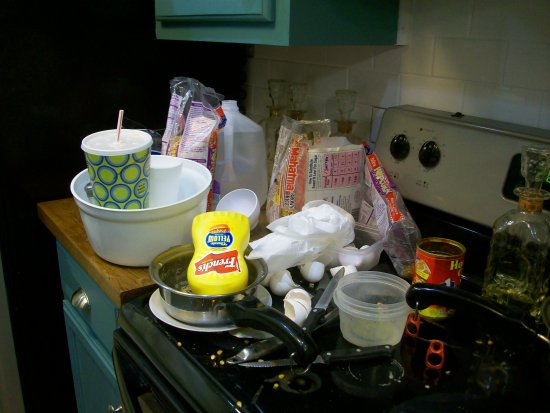
Where is `black oven dials`? black oven dials is located at coordinates (430, 161), (400, 151).